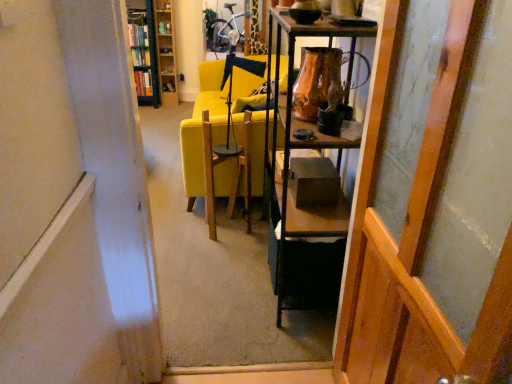
Find the location of a particular element. free spot in front of wooden chair at center is located at coordinates (229, 248).